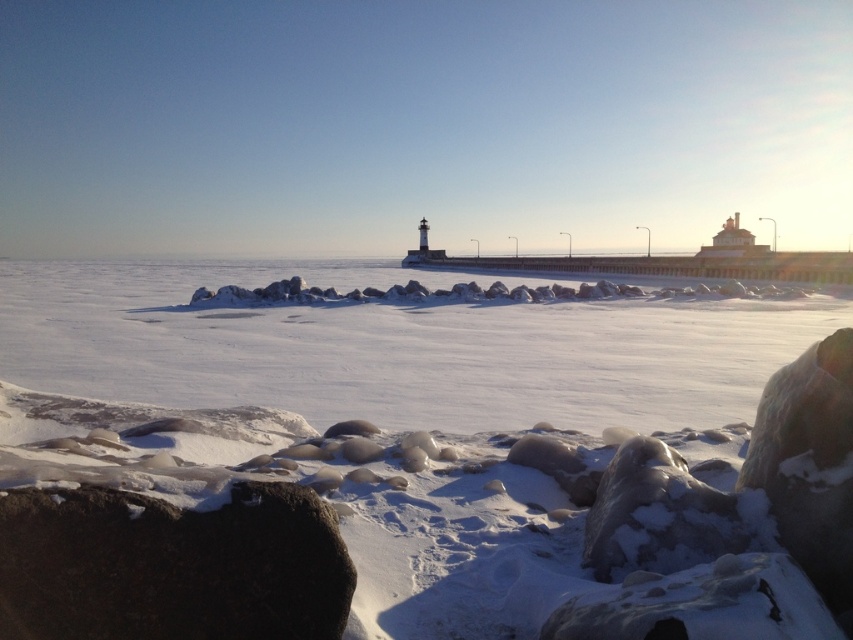
Question: Is the position of white matte snow at center more distant than that of dark gray rock at lower left?

Choices:
 (A) yes
 (B) no

Answer: (A)

Question: Which point is farther to the camera?

Choices:
 (A) dark gray rock at lower left
 (B) smooth gray rock at lower center

Answer: (B)

Question: Does dark gray rock at lower left have a greater width compared to smooth gray rock at lower center?

Choices:
 (A) no
 (B) yes

Answer: (B)

Question: Which of the following is the farthest from the observer?

Choices:
 (A) (267, 618)
 (B) (697, 538)

Answer: (B)

Question: Is dark gray rock at lower left further to camera compared to smooth gray rock at lower center?

Choices:
 (A) no
 (B) yes

Answer: (A)

Question: Which is farther from the dark gray rock at lower left?

Choices:
 (A) white matte snow at center
 (B) smooth gray rock at lower center

Answer: (A)